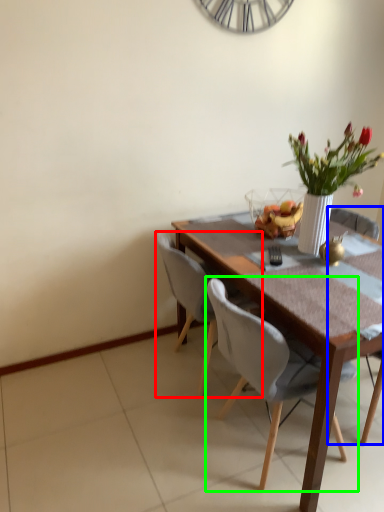
Question: Which object is positioned farthest from chair (highlighted by a red box)? Select from chair (highlighted by a blue box) and chair (highlighted by a green box).

Choices:
 (A) chair
 (B) chair

Answer: (A)